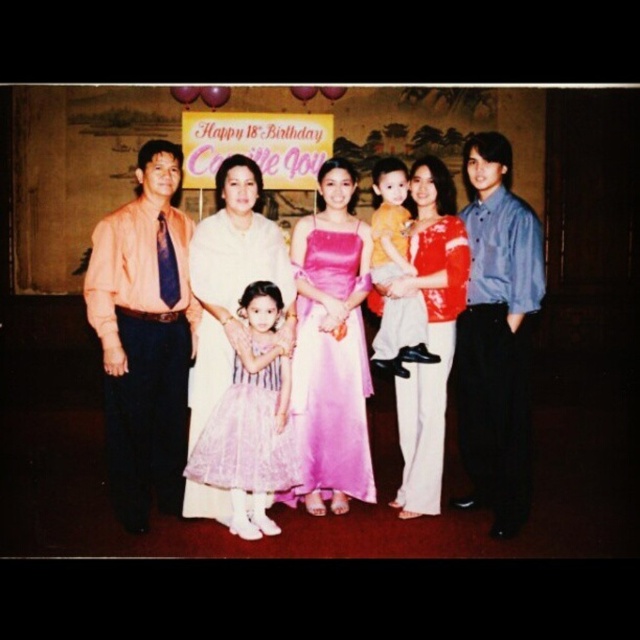
Is matte orange shirt at left taller than matte pink dress at center?

Correct, matte orange shirt at left is much taller as matte pink dress at center.

At what (x,y) coordinates should I click in order to perform the action: click on matte orange shirt at left. Please return your answer as a coordinate pair (x, y). This screenshot has height=640, width=640. Looking at the image, I should click on (145, 337).

You are a GUI agent. You are given a task and a screenshot of the screen. Output one action in this format:
    pyautogui.click(x=<x>, y=<y>)
    Task: Click on the matte orange shirt at left
    This screenshot has width=640, height=640.
    Given the screenshot: What is the action you would take?
    pyautogui.click(x=145, y=337)

Is matte pink dress at center to the right of yellow fabric shirt at center from the viewer's perspective?

Indeed, matte pink dress at center is positioned on the right side of yellow fabric shirt at center.

Is point (468, 268) behind point (406, 227)?

That is False.

Between point (413, 273) and point (406, 355), which one is positioned behind?

The point (413, 273) is more distant.

Locate an element on the screen. Image resolution: width=640 pixels, height=640 pixels. matte pink dress at center is located at coordinates (428, 332).

Can you confirm if blue shirt at right is positioned to the left of matte white blouse at center?

In fact, blue shirt at right is to the right of matte white blouse at center.

Looking at this image, does blue shirt at right have a lesser width compared to matte white blouse at center?

Indeed, blue shirt at right has a lesser width compared to matte white blouse at center.

The width and height of the screenshot is (640, 640). What do you see at coordinates (497, 337) in the screenshot? I see `blue shirt at right` at bounding box center [497, 337].

Identify the location of blue shirt at right. (497, 337).